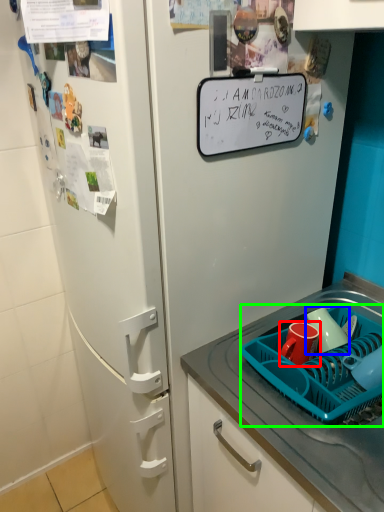
Question: Which is nearer to the coffee cup (highlighted by a red box)? mug (highlighted by a blue box) or basket (highlighted by a green box).

Choices:
 (A) mug
 (B) basket

Answer: (A)